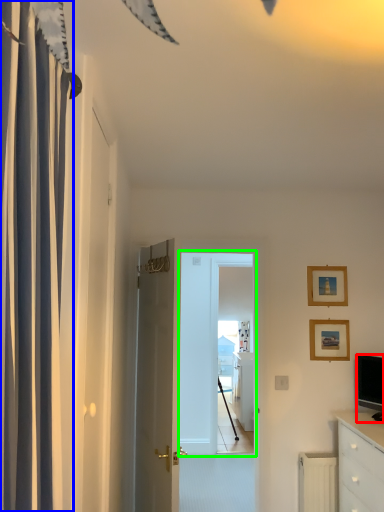
Question: Based on their relative distances, which object is farther from television (highlighted by a red box)? Choose from curtain (highlighted by a blue box) and screen door (highlighted by a green box).

Choices:
 (A) curtain
 (B) screen door

Answer: (A)